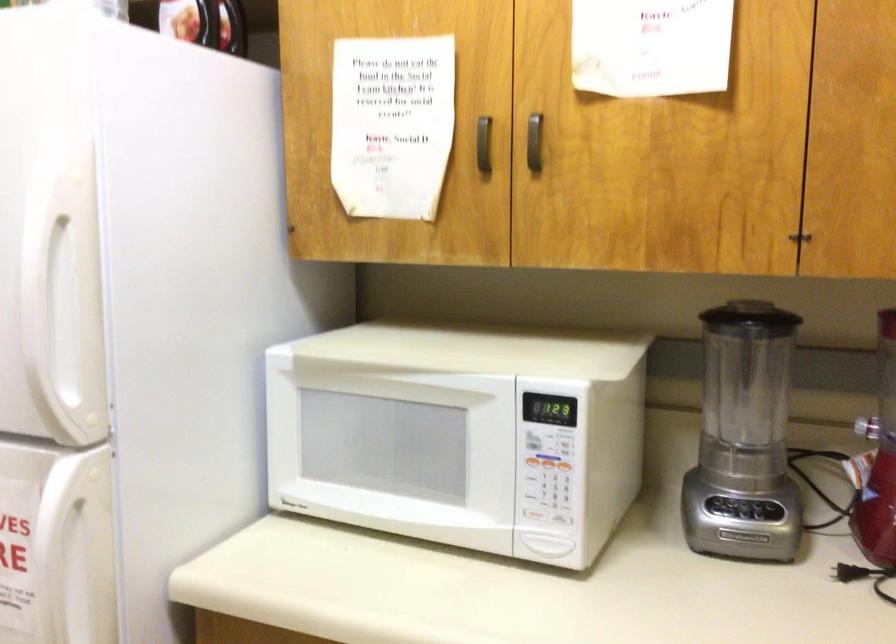
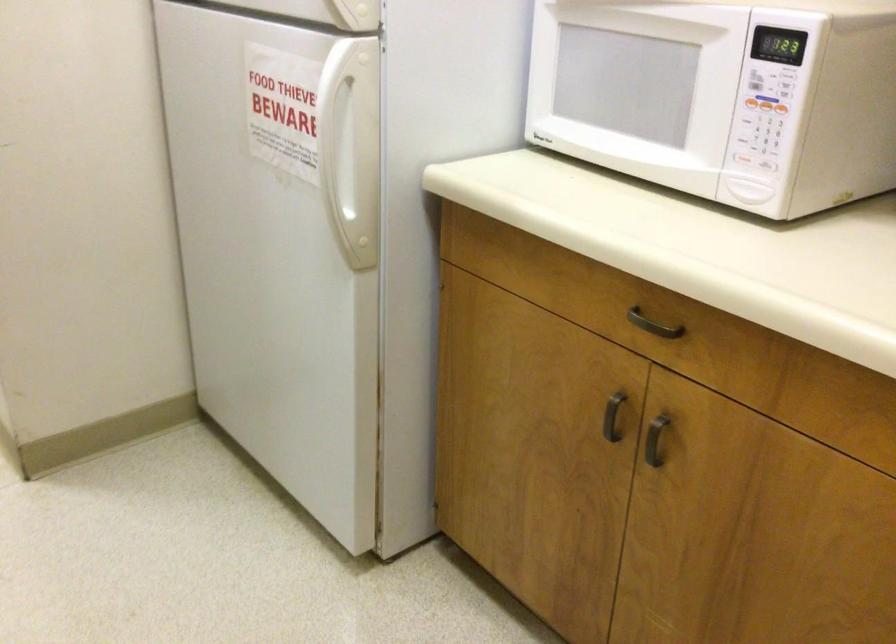
Where in the second image is the point corresponding to [536,518] from the first image?

(741, 158)